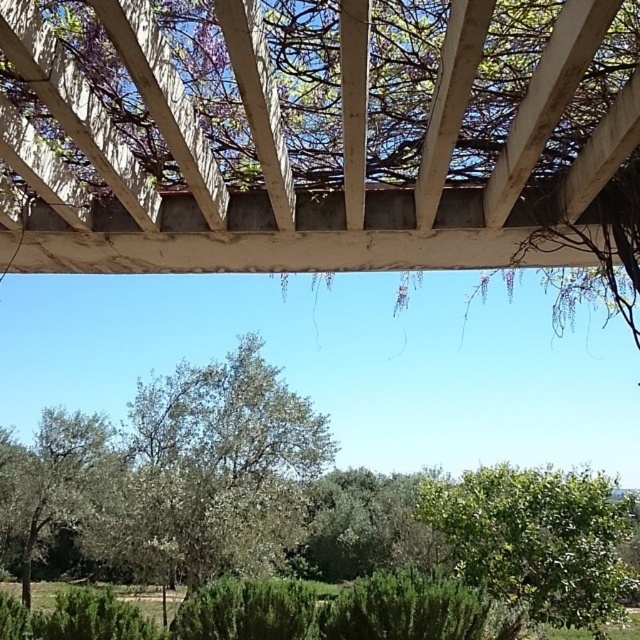
Can you confirm if green leafy tree at center is wider than green leafy tree at lower right?

No.

Consider the image. Can you confirm if green leafy tree at center is thinner than green leafy tree at lower right?

Yes, green leafy tree at center is thinner than green leafy tree at lower right.

Where is `green leafy tree at center`? Image resolution: width=640 pixels, height=640 pixels. green leafy tree at center is located at coordinates (317, 134).

The image size is (640, 640). I want to click on green leafy tree at center, so click(317, 134).